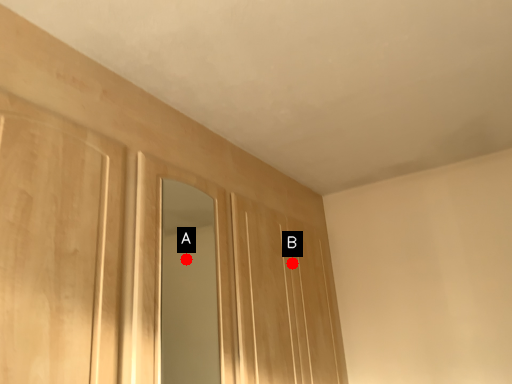
Question: Two points are circled on the image, labeled by A and B beside each circle. Which point appears closest to the camera in this image?

Choices:
 (A) A is closer
 (B) B is closer

Answer: (B)